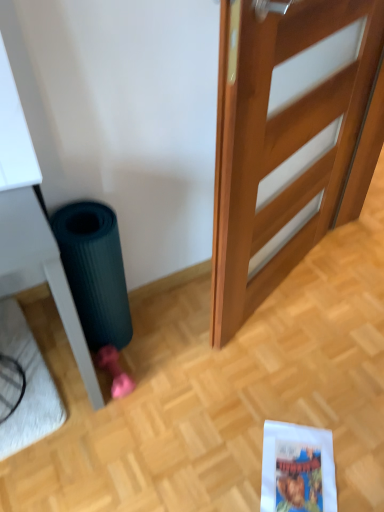
Where is `free space in front of wooden door at center`? The image size is (384, 512). free space in front of wooden door at center is located at coordinates pos(289,389).